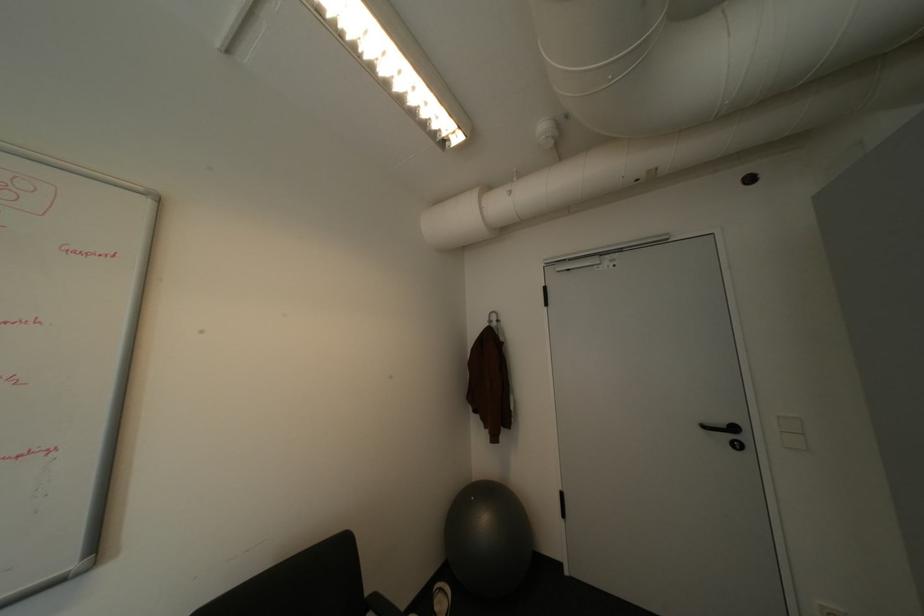
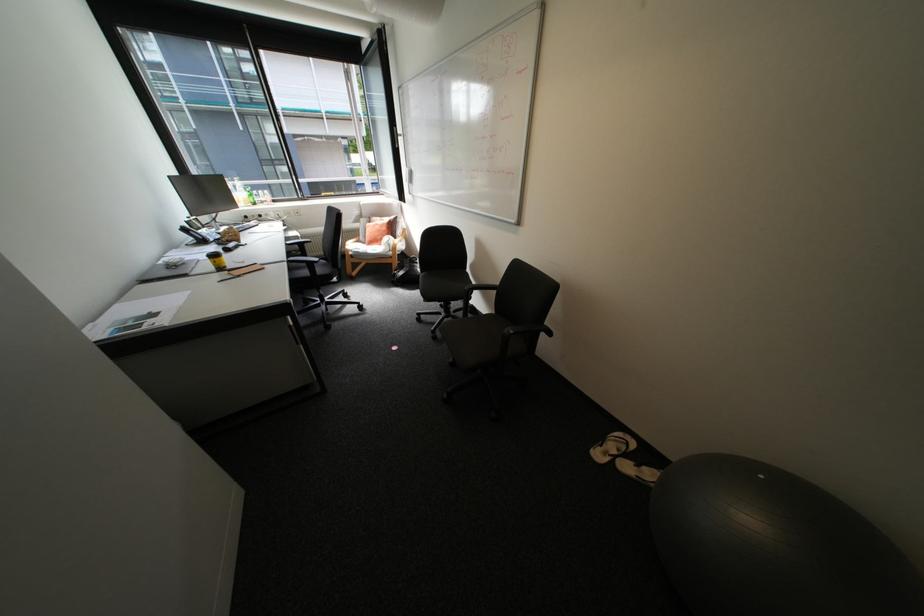
Locate, in the second image, the point that corresponds to (482,498) in the first image.

(772, 477)